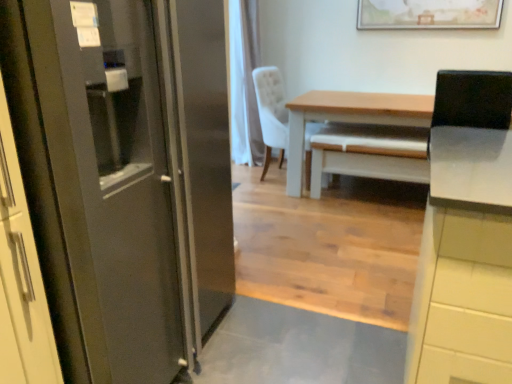
Question: Is satin metallic refrigerator at left positioned with its back to wooden framed artwork at upper center?

Choices:
 (A) yes
 (B) no

Answer: (B)

Question: From a real-world perspective, is satin metallic refrigerator at left beneath wooden framed artwork at upper center?

Choices:
 (A) no
 (B) yes

Answer: (B)

Question: Can you confirm if satin metallic refrigerator at left is smaller than wooden framed artwork at upper center?

Choices:
 (A) yes
 (B) no

Answer: (B)

Question: Could wooden framed artwork at upper center be considered to be inside satin metallic refrigerator at left?

Choices:
 (A) yes
 (B) no

Answer: (B)

Question: Can you confirm if satin metallic refrigerator at left is positioned to the right of wooden framed artwork at upper center?

Choices:
 (A) no
 (B) yes

Answer: (A)

Question: Considering the relative sizes of satin metallic refrigerator at left and wooden framed artwork at upper center in the image provided, is satin metallic refrigerator at left wider than wooden framed artwork at upper center?

Choices:
 (A) no
 (B) yes

Answer: (B)

Question: Can you confirm if satin metallic refrigerator at left is thinner than white fabric chair at center?

Choices:
 (A) no
 (B) yes

Answer: (A)

Question: Is satin metallic refrigerator at left wider than white fabric chair at center?

Choices:
 (A) no
 (B) yes

Answer: (B)

Question: Are satin metallic refrigerator at left and white fabric chair at center making contact?

Choices:
 (A) yes
 (B) no

Answer: (B)

Question: From a real-world perspective, is satin metallic refrigerator at left beneath white fabric chair at center?

Choices:
 (A) yes
 (B) no

Answer: (B)

Question: Does satin metallic refrigerator at left have a lesser height compared to white fabric chair at center?

Choices:
 (A) yes
 (B) no

Answer: (B)

Question: Can white fabric chair at center be found inside satin metallic refrigerator at left?

Choices:
 (A) no
 (B) yes

Answer: (A)

Question: Is wooden framed artwork at upper center facing towards light brown wooden table at center?

Choices:
 (A) yes
 (B) no

Answer: (B)